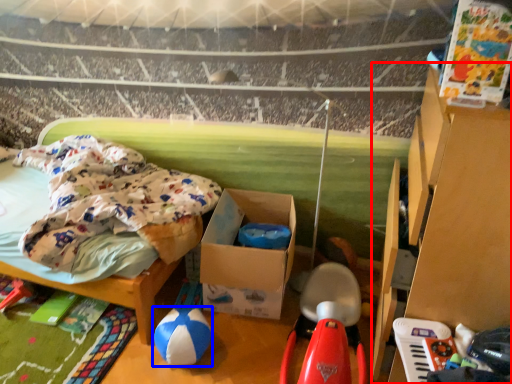
Question: Which object appears farthest to the camera in this image, furniture (highlighted by a red box) or toy (highlighted by a blue box)?

Choices:
 (A) furniture
 (B) toy

Answer: (B)